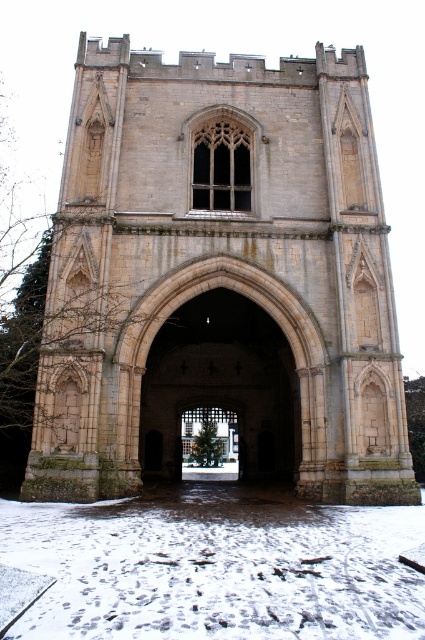
Image resolution: width=425 pixels, height=640 pixels. Describe the element at coordinates (223, 276) in the screenshot. I see `light brown stone church at center` at that location.

Between light brown stone church at center and green matte christmas tree at center, which one is positioned lower?

green matte christmas tree at center is below.

Who is more distant from viewer, (266, 332) or (220, 410)?

Positioned behind is point (220, 410).

Find the location of a particular element. light brown stone church at center is located at coordinates (223, 276).

Is point (59, 586) more distant than point (221, 451)?

No, (59, 586) is in front of (221, 451).

Can you confirm if white powdery snow at lower center is shorter than green matte christmas tree at center?

Indeed, white powdery snow at lower center has a lesser height compared to green matte christmas tree at center.

Does point (212, 502) lie behind point (197, 419)?

No.

Find the location of a particular element. This screenshot has width=425, height=640. white powdery snow at lower center is located at coordinates (217, 566).

Looking at this image, can you confirm if light brown stone church at center is positioned above white powdery snow at lower center?

Yes, light brown stone church at center is above white powdery snow at lower center.

Is light brown stone church at center taller than white powdery snow at lower center?

Yes, light brown stone church at center is taller than white powdery snow at lower center.

Who is more forward, (70,404) or (249,595)?

Point (249,595)

Where is `light brown stone church at center`? The height and width of the screenshot is (640, 425). light brown stone church at center is located at coordinates (223, 276).